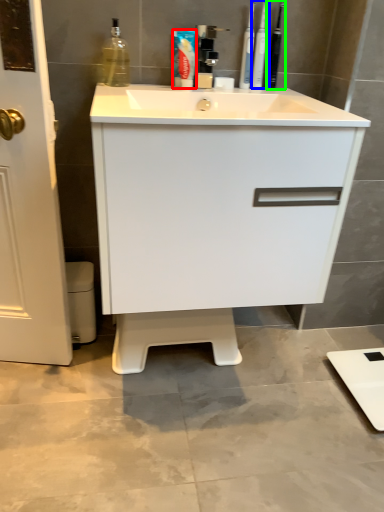
Question: Which is nearer to the toothpaste (highlighted by a red box)? toiletry (highlighted by a blue box) or toiletry (highlighted by a green box).

Choices:
 (A) toiletry
 (B) toiletry

Answer: (A)